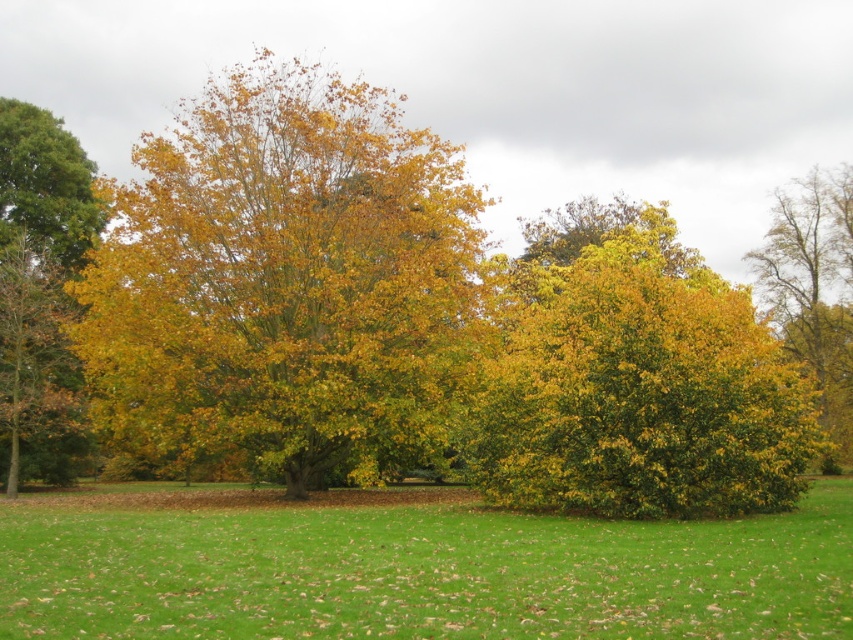
Is yellow-green foliage at center smaller than smooth brown tree trunk at right?

No, yellow-green foliage at center is not smaller than smooth brown tree trunk at right.

Which is more to the right, yellow-green foliage at center or smooth brown tree trunk at right?

smooth brown tree trunk at right

Who is more forward, (84, 285) or (802, 192)?

Positioned in front is point (84, 285).

The image size is (853, 640). I want to click on yellow-green foliage at center, so click(x=283, y=280).

Does yellow-green foliage at center appear on the right side of green grass at center?

Incorrect, yellow-green foliage at center is not on the right side of green grass at center.

Who is more forward, (294, 180) or (764, 620)?

Point (764, 620)

Measure the distance between yellow-green foliage at center and camera.

26.37 meters

Locate an element on the screen. This screenshot has height=640, width=853. yellow-green foliage at center is located at coordinates (283, 280).

Is green grass at center positioned at the back of smooth brown tree trunk at right?

No, green grass at center is in front of smooth brown tree trunk at right.

What do you see at coordinates (424, 572) in the screenshot?
I see `green grass at center` at bounding box center [424, 572].

The image size is (853, 640). In order to click on green grass at center in this screenshot , I will do 424,572.